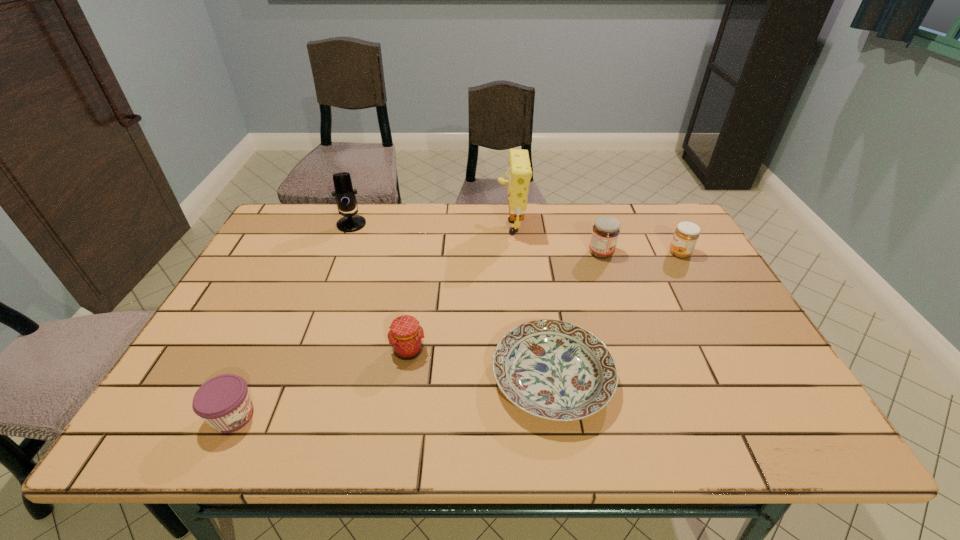
Identify the location of sponge. The image size is (960, 540). (519, 173).

At what (x,y) coordinates should I click in order to perform the action: click on the sixth shortest object. Please return your answer as a coordinate pair (x, y). The width and height of the screenshot is (960, 540). Looking at the image, I should click on (344, 194).

Where is `the second object from right to left`? the second object from right to left is located at coordinates (605, 232).

Find the location of `the rightmost jam`. the rightmost jam is located at coordinates (685, 237).

Find the location of a particular element. This screenshot has width=960, height=540. the third farthest jam is located at coordinates (406, 336).

The height and width of the screenshot is (540, 960). I want to click on the third object from left to right, so tap(406, 336).

In order to click on the nearest jam in this screenshot , I will do `click(223, 401)`.

Identify the location of plate. This screenshot has width=960, height=540. (555, 370).

Locate an element on the screen. The width and height of the screenshot is (960, 540). vacant space positioned 0.200m on the face of the tallest object is located at coordinates (435, 224).

Locate an element on the screen. The height and width of the screenshot is (540, 960). vacant space located on the face of the tallest object is located at coordinates (463, 224).